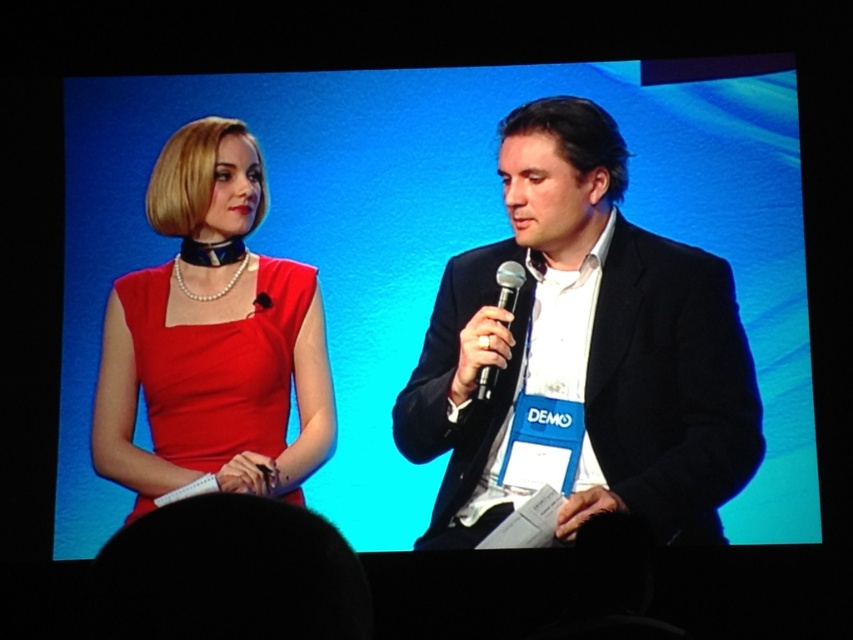
Question: Which point is closer to the camera taking this photo?

Choices:
 (A) (502, 278)
 (B) (119, 324)
 (C) (540, 236)

Answer: (A)

Question: Which point is closer to the camera?

Choices:
 (A) (721, 467)
 (B) (329, 484)
 (C) (520, 282)

Answer: (A)

Question: Where is black matte suit at center located in relation to black metallic microphone at center in the image?

Choices:
 (A) right
 (B) left

Answer: (A)

Question: Observing the image, what is the correct spatial positioning of matte black microphone at center in reference to matte red dress at left?

Choices:
 (A) left
 (B) right

Answer: (B)

Question: Does black matte suit at center come in front of black metallic microphone at center?

Choices:
 (A) yes
 (B) no

Answer: (A)

Question: Which point appears farthest from the camera in this image?

Choices:
 (A) (746, 387)
 (B) (503, 264)
 (C) (259, 467)
 (D) (796, 284)

Answer: (D)